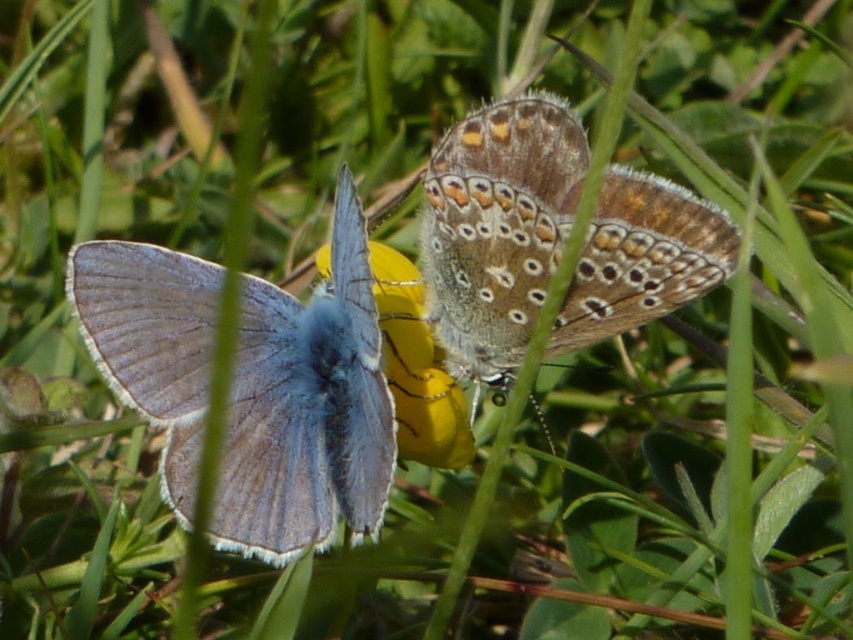
You are a photographer trying to capture the matte blue butterfly at left and the yellow matte flower at center. Which object is positioned closer to your camera lens?

The matte blue butterfly at left is closer to the viewer than the yellow matte flower at center, so it will appear closer to the camera lens.